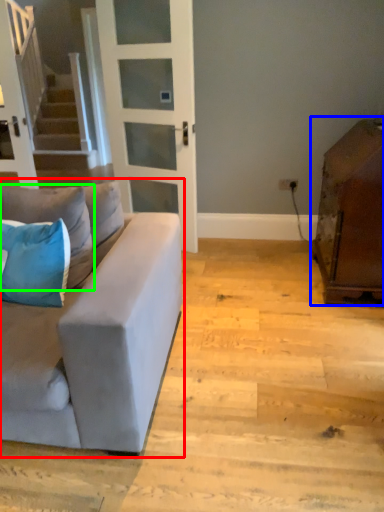
Question: Which is farther away from studio couch (highlighted by a red box)? cabinetry (highlighted by a blue box) or pillow (highlighted by a green box)?

Choices:
 (A) cabinetry
 (B) pillow

Answer: (A)